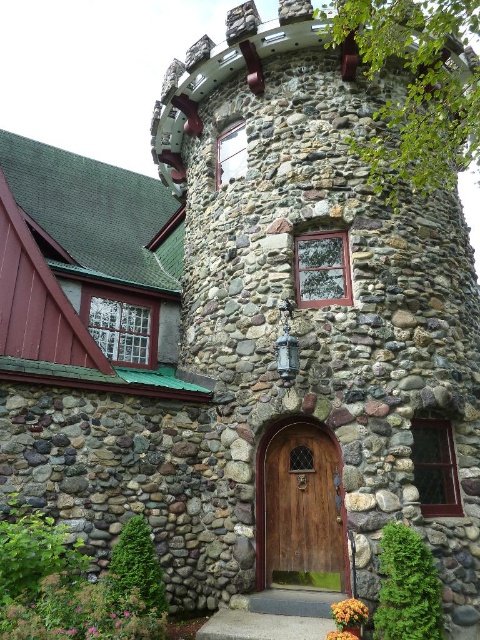
Question: Is wooden door at center smaller than pink soft-textured flowers at lower left?

Choices:
 (A) yes
 (B) no

Answer: (B)

Question: Estimate the real-world distances between objects in this image. Which object is farther from the pink soft-textured flowers at lower left?

Choices:
 (A) orange matte flower at lower center
 (B) wooden door at center

Answer: (B)

Question: Can you confirm if wooden door at center is wider than pink soft-textured flowers at lower left?

Choices:
 (A) yes
 (B) no

Answer: (B)

Question: Which object is closer to the camera taking this photo?

Choices:
 (A) orange matte flower at lower right
 (B) wooden door at center
 (C) orange matte flower at lower center

Answer: (C)

Question: Does orange matte flower at lower right appear under orange matte flower at lower center?

Choices:
 (A) no
 (B) yes

Answer: (A)

Question: Which is farther from the pink soft-textured flowers at lower left?

Choices:
 (A) orange matte flower at lower center
 (B) orange matte flower at lower right
 (C) wooden door at center

Answer: (B)